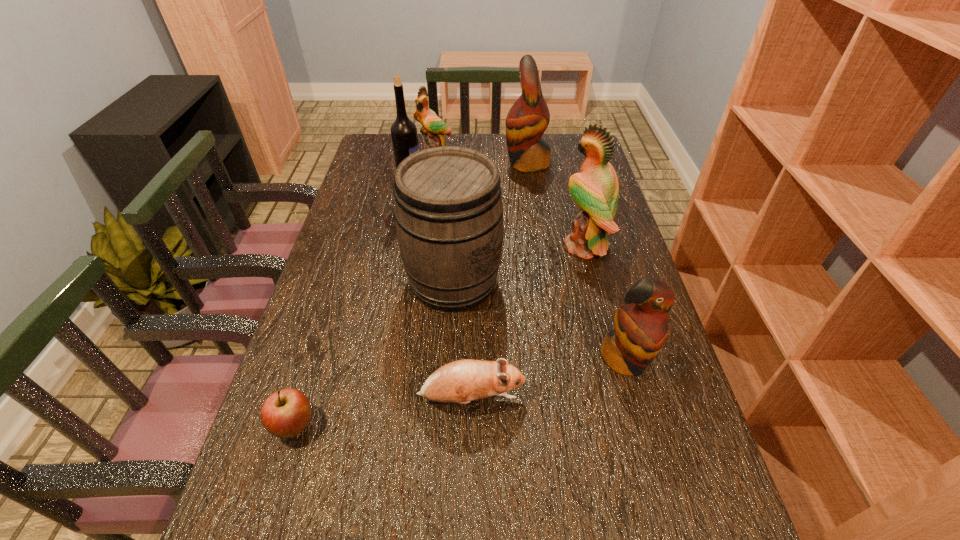
This screenshot has width=960, height=540. I want to click on free space located 0.260m on the front-facing side of the nearer green parrot, so click(469, 246).

Identify the location of free space located 0.170m on the front of the wine bucket. (447, 377).

Identify the location of free space located on the front-facing side of the farther green parrot. (430, 193).

What are the coordinates of `vacant position located on the face of the smaller red parrot` in the screenshot? It's located at (646, 437).

You are a GUI agent. You are given a task and a screenshot of the screen. Output one action in this format:
    pyautogui.click(x=<x>, y=<y>)
    Task: Click on the vacant space located at the face of the brown hamster
    
    Given the screenshot: What is the action you would take?
    pyautogui.click(x=634, y=399)

Locate an element on the screen. vacant region located 0.340m on the right of the apple is located at coordinates (487, 426).

Where is `object at the left edge`? This screenshot has width=960, height=540. object at the left edge is located at coordinates (285, 413).

Locate an element on the screen. vacant space at the far edge of the desktop is located at coordinates point(468,147).

At what (x,y) coordinates should I click in order to perform the action: click on free region at the left edge of the desktop. Please return your answer as a coordinate pair (x, y). Looking at the image, I should click on (367, 167).

The height and width of the screenshot is (540, 960). I want to click on free space at the right edge of the desktop, so click(635, 421).